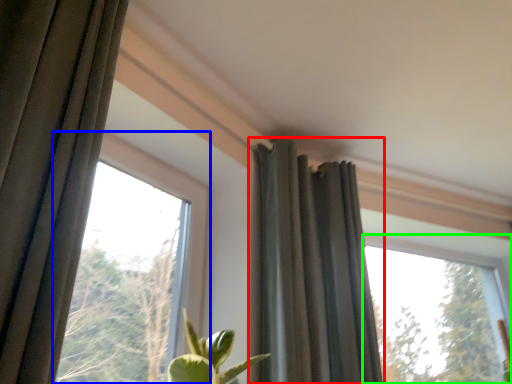
Question: Considering the real-world distances, which object is closest to curtain (highlighted by a red box)? window (highlighted by a blue box) or window (highlighted by a green box).

Choices:
 (A) window
 (B) window

Answer: (A)